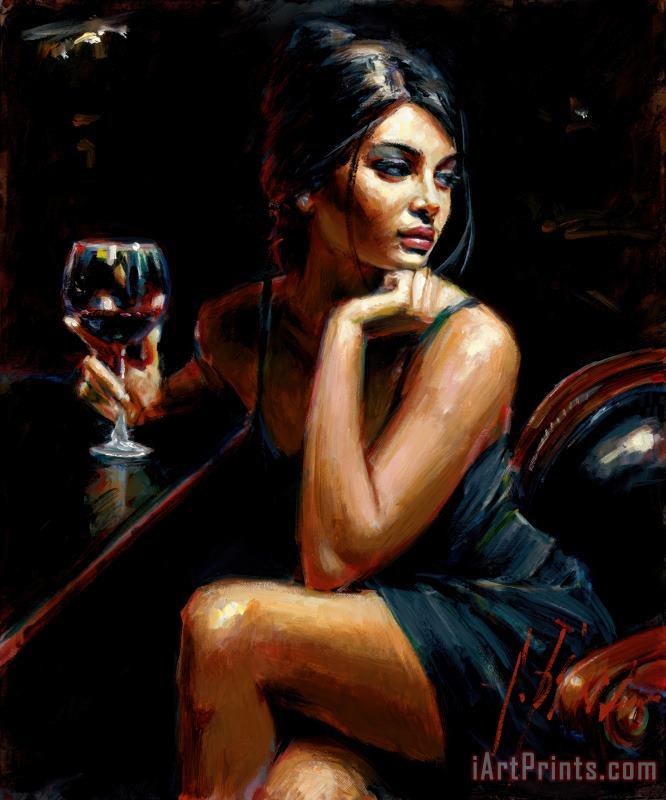
Identify the location of wine glass. (122, 304).